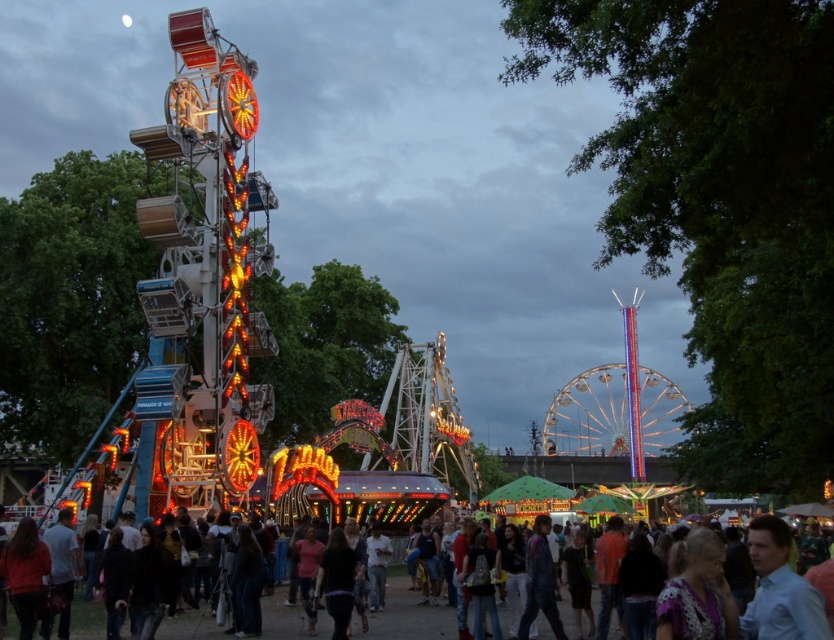
Is illuminated metal ferris wheel at center in front of light blue shirt at lower right?

No, it is behind light blue shirt at lower right.

Identify the location of illuminated metal ferris wheel at center. This screenshot has width=834, height=640. (589, 413).

This screenshot has height=640, width=834. Describe the element at coordinates (589, 413) in the screenshot. I see `illuminated metal ferris wheel at center` at that location.

The image size is (834, 640). In order to click on illuminated metal ferris wheel at center in this screenshot , I will do `click(589, 413)`.

Does illuminated metal ferris wheel at center appear on the left side of dark blue shirt at center?

Incorrect, illuminated metal ferris wheel at center is not on the left side of dark blue shirt at center.

Is point (642, 404) farther from camera compared to point (176, 628)?

Yes, it is behind point (176, 628).

You are a GUI agent. You are given a task and a screenshot of the screen. Output one action in this format:
    pyautogui.click(x=<x>, y=<y>)
    Task: Click on the illuminated metal ferris wheel at center
    
    Given the screenshot: What is the action you would take?
    pyautogui.click(x=589, y=413)

Does dark blue shirt at center appear under light blue shirt at lower right?

Yes, dark blue shirt at center is below light blue shirt at lower right.

The width and height of the screenshot is (834, 640). What do you see at coordinates (408, 618) in the screenshot?
I see `dark blue shirt at center` at bounding box center [408, 618].

I want to click on dark blue shirt at center, so click(x=408, y=618).

Find the location of a particular element. This screenshot has height=640, width=834. dark blue shirt at center is located at coordinates (408, 618).